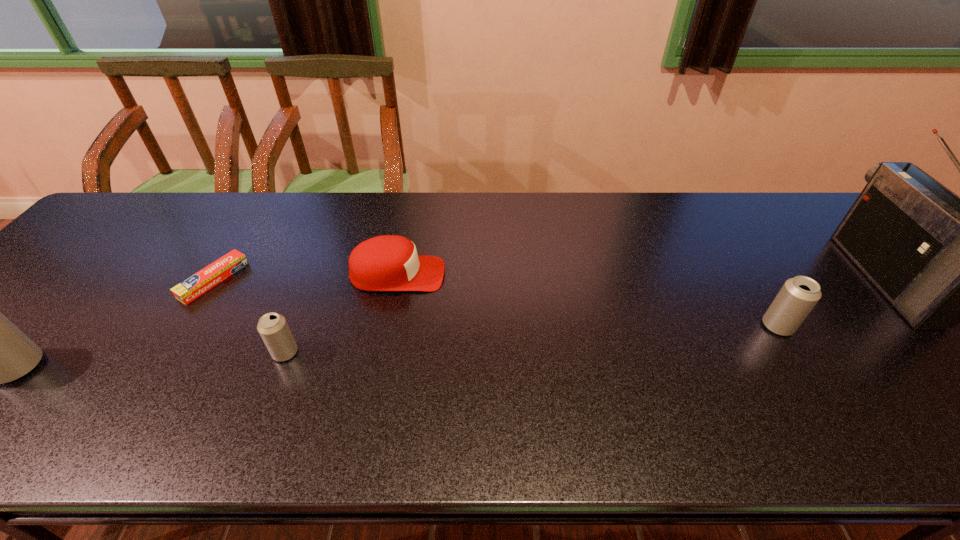
I want to click on the fourth object from right to left, so click(272, 327).

The width and height of the screenshot is (960, 540). What are the coordinates of `the second beer can from left to right` in the screenshot? It's located at (272, 327).

This screenshot has width=960, height=540. Find the location of `the second object from right to left`. the second object from right to left is located at coordinates (798, 296).

Locate an element on the screen. This screenshot has width=960, height=540. the farthest beer can is located at coordinates (798, 296).

This screenshot has height=540, width=960. Identify the location of toothpaste. (202, 281).

Where is `the shortest object`? This screenshot has width=960, height=540. the shortest object is located at coordinates (202, 281).

You are a GUI agent. You are given a task and a screenshot of the screen. Output one action in this format:
    pyautogui.click(x=<x>, y=<y>)
    Task: Click on the fourth object from left to right
    This screenshot has height=540, width=960.
    Given the screenshot: What is the action you would take?
    pyautogui.click(x=389, y=262)

Identify the location of free space located 0.090m on the front of the shortest beer can. The width and height of the screenshot is (960, 540). (267, 401).

At what (x,y) coordinates should I click in order to perform the action: click on vacant space located on the right of the third tallest object. Please return your answer as a coordinate pair (x, y). Looking at the image, I should click on (956, 326).

Find the location of a particular element. This screenshot has width=960, height=540. free point located 0.280m on the back of the shortest object is located at coordinates (264, 199).